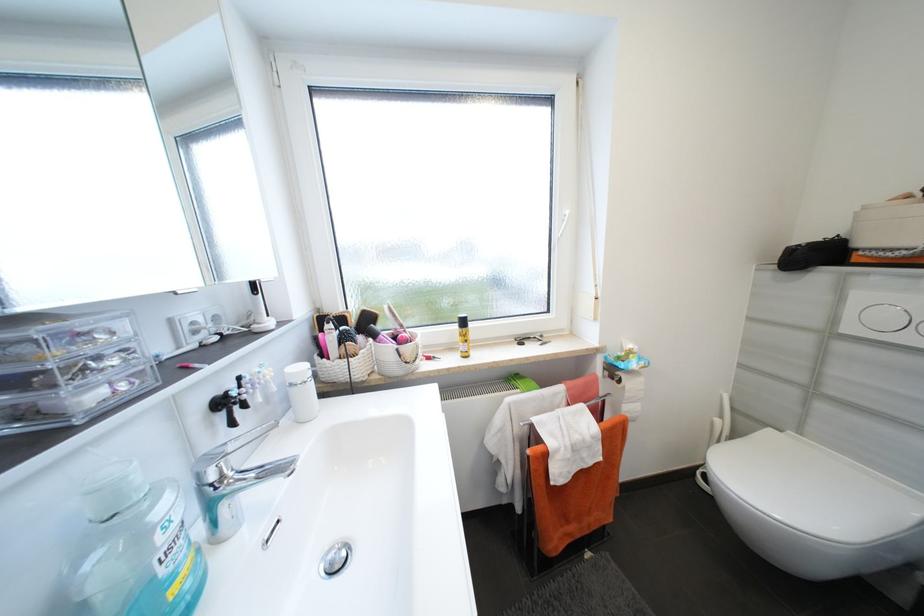
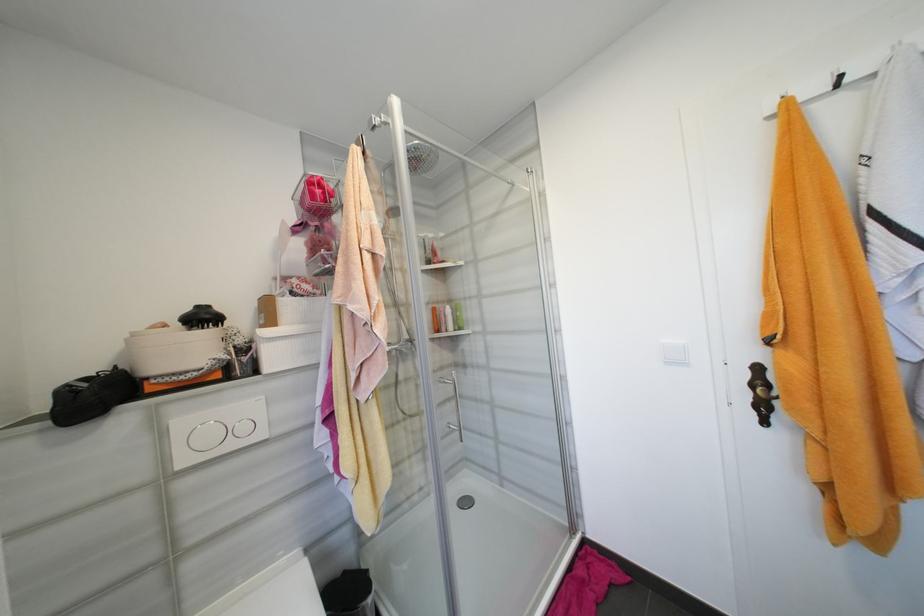
The point at (870, 208) is marked in the first image. Where is the corresponding point in the second image?

(140, 334)